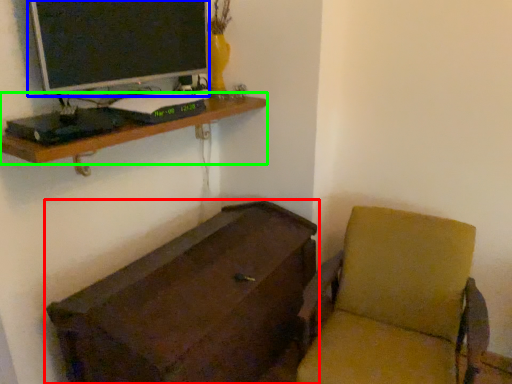
Question: Which is nearer to the furniture (highlighted by a red box)? computer monitor (highlighted by a blue box) or shelf (highlighted by a green box).

Choices:
 (A) computer monitor
 (B) shelf

Answer: (B)